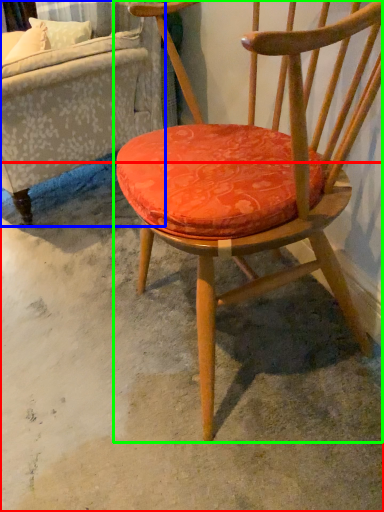
Question: Considering the real-world distances, which object is closest to concrete (highlighted by a red box)? studio couch (highlighted by a blue box) or chair (highlighted by a green box).

Choices:
 (A) studio couch
 (B) chair

Answer: (B)